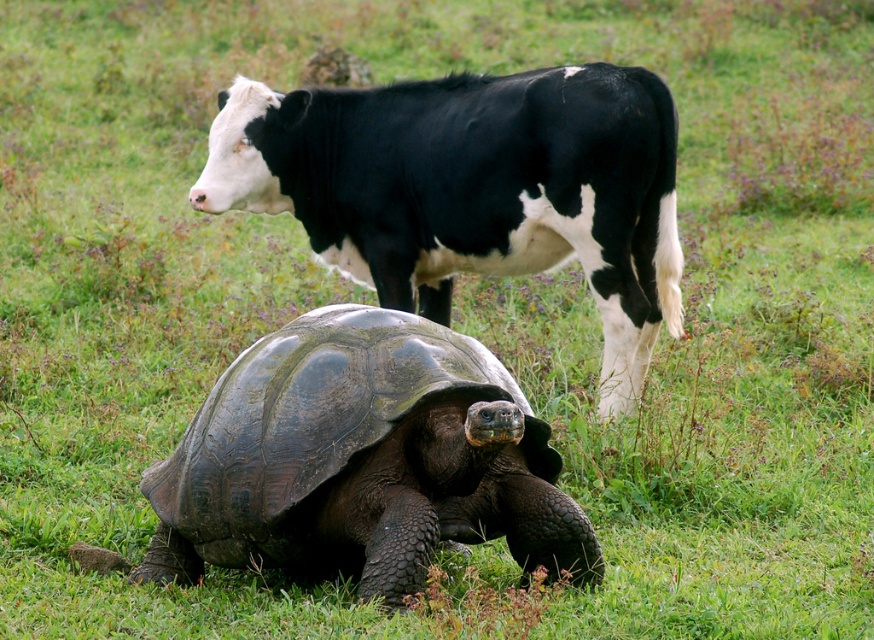
Measure the distance from shiny dark brown tortoise at center to dark brown scaly tortoise at center.

shiny dark brown tortoise at center and dark brown scaly tortoise at center are 6.26 feet apart from each other.

Measure the distance from shiny dark brown tortoise at center to dark brown scaly tortoise at center.

1.91 meters

What do you see at coordinates (473, 188) in the screenshot?
I see `shiny dark brown tortoise at center` at bounding box center [473, 188].

Image resolution: width=874 pixels, height=640 pixels. I want to click on shiny dark brown tortoise at center, so click(473, 188).